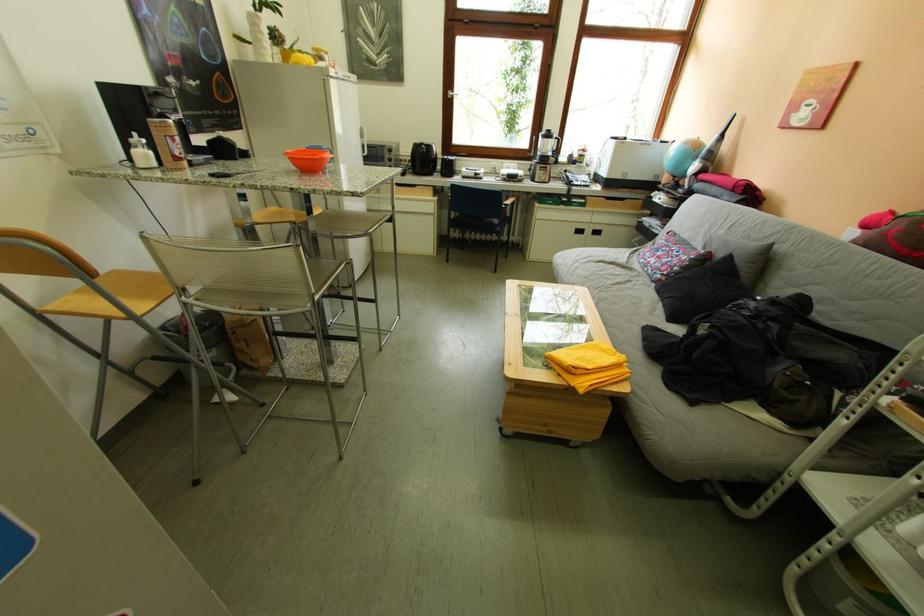
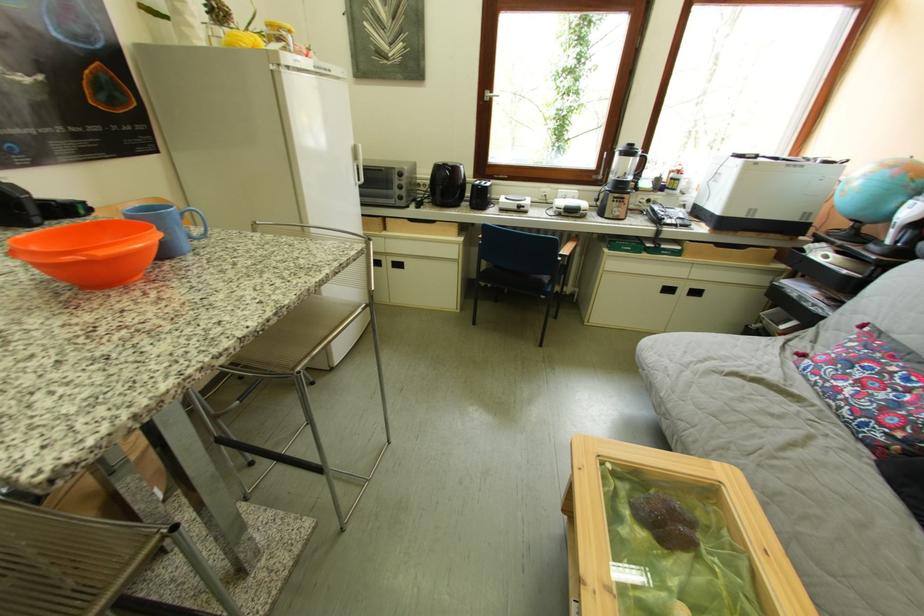
The point at (659, 262) is marked in the first image. Where is the corresponding point in the second image?

(841, 384)